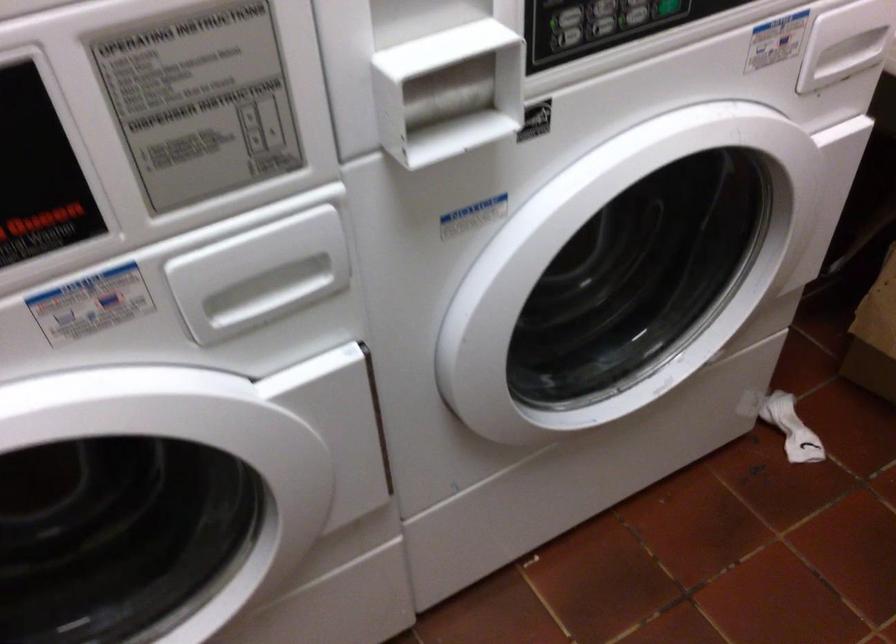
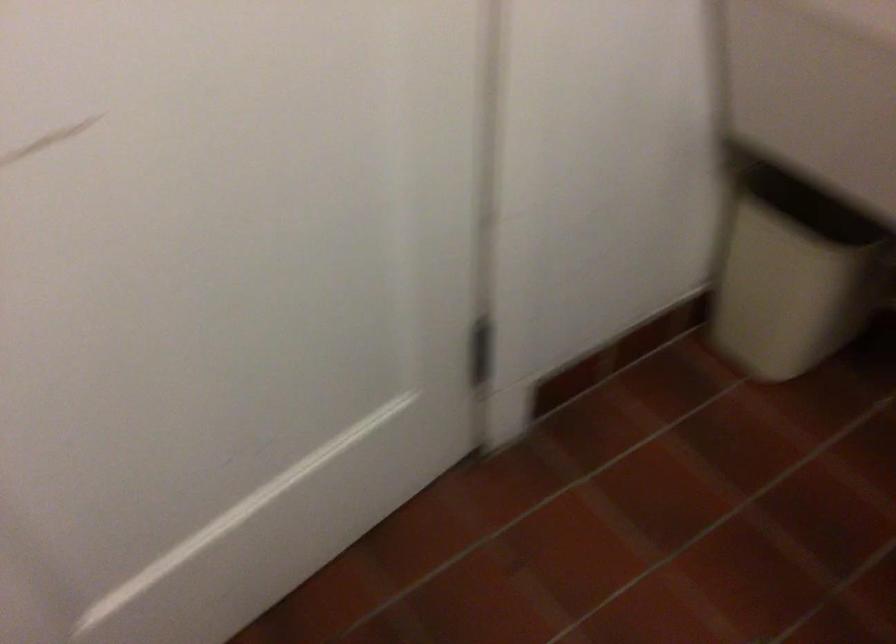
Based on the continuous images, in which direction is the camera rotating?

The camera rotated toward left-down.